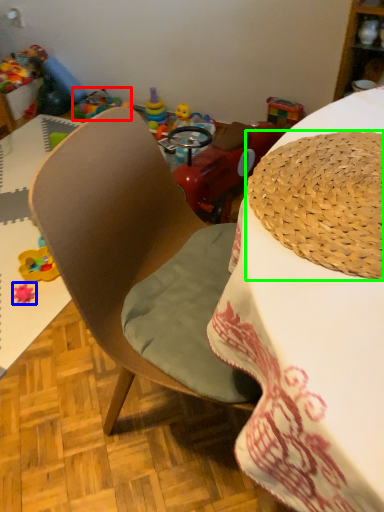
Question: Which object is positioned closest to toy (highlighted by a red box)? Select from toy (highlighted by a blue box) and hat (highlighted by a green box).

Choices:
 (A) toy
 (B) hat

Answer: (A)